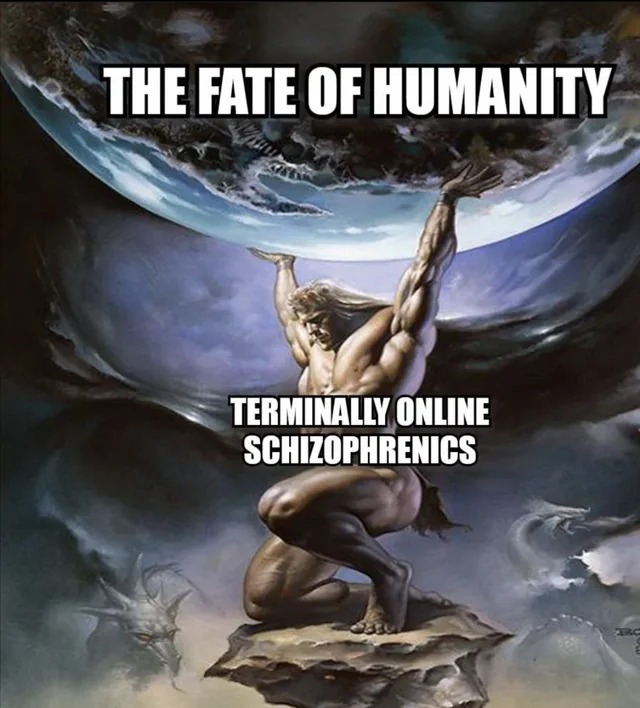
This screenshot has height=708, width=640. In order to click on chest in this screenshot , I will do `click(372, 342)`.